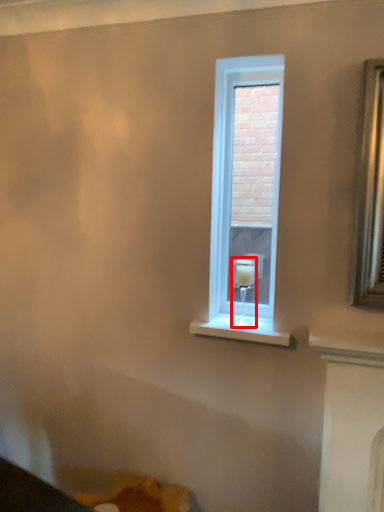
Question: From the image's perspective, where is candle holder (annotated by the red box) located relative to window?

Choices:
 (A) above
 (B) below

Answer: (B)